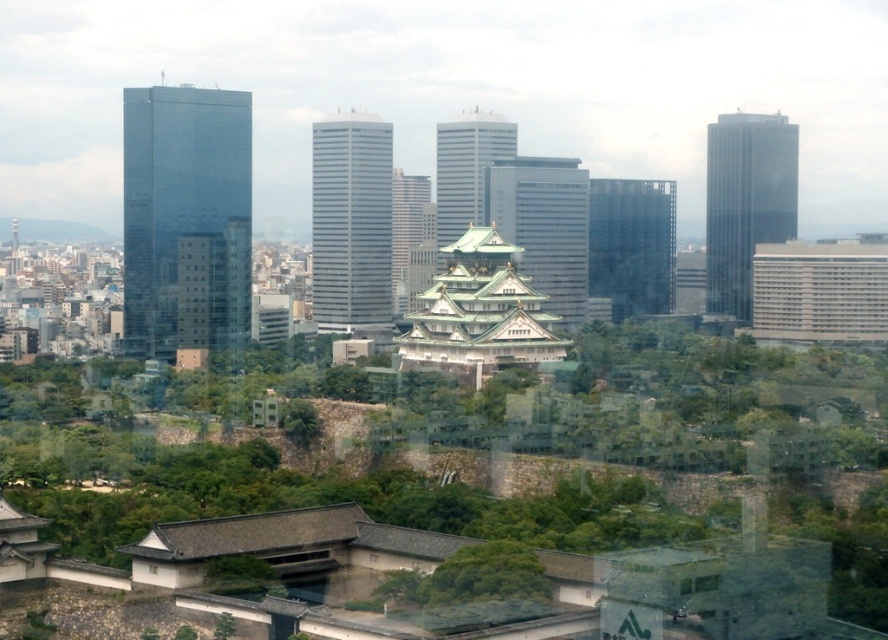
In the scene shown: You are an urban planner assessing the distance between the green leafy tree at center and the white glass tower at center in the image. Given that the minimum required distance for proper tree growth near buildings is 60 meters, does this spacing meet the requirement?

The green leafy tree at center and the white glass tower at center are 73.76 meters apart from each other, which exceeds the 60 meters minimum requirement for proper tree growth near buildings.

You are an architect analyzing the image. You need to determine which structure has a narrower width between the white glass tower at center and the glassy reflective skyscraper at right. Which one is narrower?

The white glass tower at center has a narrower width than the glassy reflective skyscraper at right according to the description.

You are an architect designing a new building that needs to maintain a harmonious balance between traditional and modern elements. You observe the green leafy tree at center and the white glass tower at center in the scene. Which object should you reference for the height of your building to ensure it aligns with the traditional elements?

The green leafy tree at center has a greater height compared to the white glass tower at center. To align with traditional elements, you should reference the height of the green leafy tree at center since it represents the natural, historical aspect of the scene.